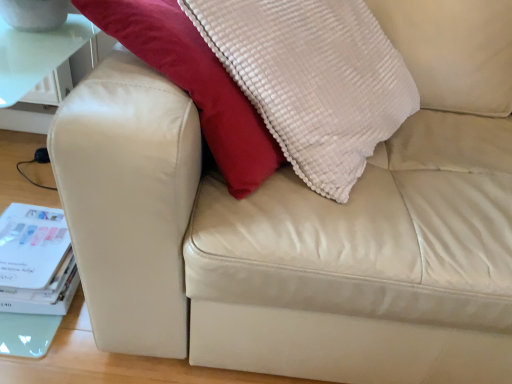
The height and width of the screenshot is (384, 512). I want to click on vacant space situated above white paper at lower left (from a real-world perspective), so click(x=32, y=239).